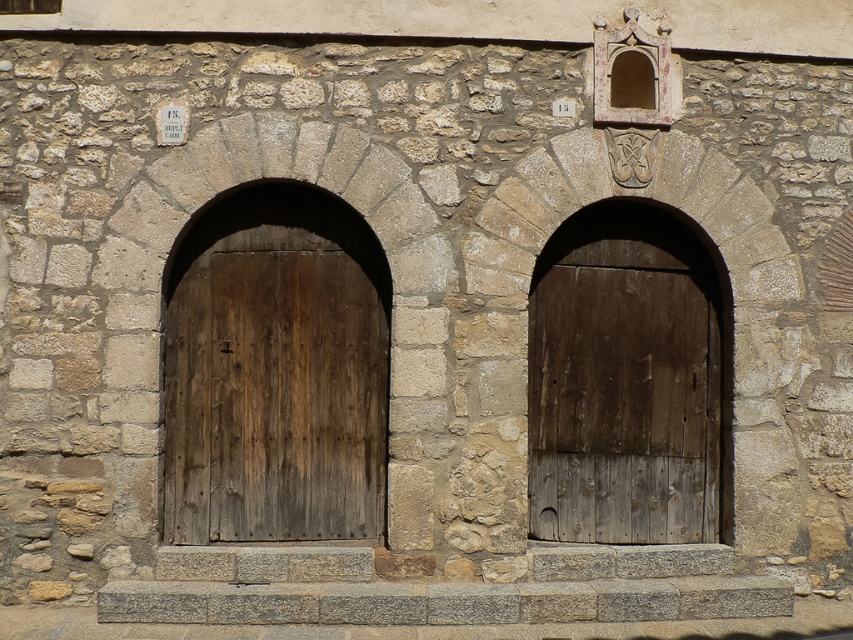
Is weathered wood door at center shorter than dark brown wooden door at center?

No, weathered wood door at center is not shorter than dark brown wooden door at center.

Is weathered wood door at center to the right of dark brown wooden door at center from the viewer's perspective?

In fact, weathered wood door at center is to the left of dark brown wooden door at center.

The image size is (853, 640). What do you see at coordinates (276, 392) in the screenshot?
I see `weathered wood door at center` at bounding box center [276, 392].

Where is `weathered wood door at center`? weathered wood door at center is located at coordinates (276, 392).